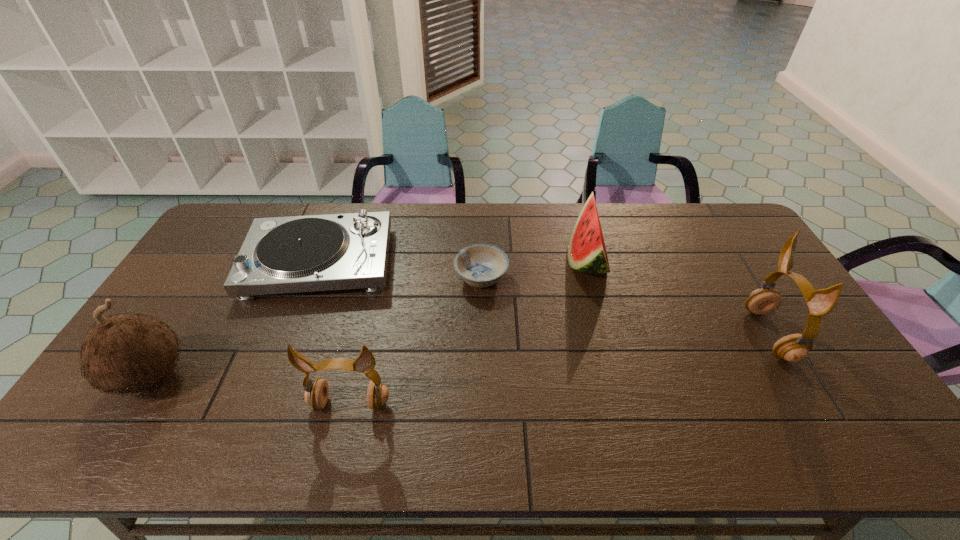
Where is `the left earphone`? Image resolution: width=960 pixels, height=540 pixels. the left earphone is located at coordinates (316, 393).

Locate an element on the screen. This screenshot has height=540, width=960. the nearer earphone is located at coordinates (316, 393).

This screenshot has height=540, width=960. I want to click on the right earphone, so [x=794, y=348].

The width and height of the screenshot is (960, 540). Find the location of `the taller earphone`. the taller earphone is located at coordinates (794, 348).

This screenshot has height=540, width=960. What are the coordinates of `watermelon` in the screenshot? It's located at (587, 253).

Where is `the fifth object from left to right`? the fifth object from left to right is located at coordinates (587, 253).

Find the location of a particular element. This screenshot has height=540, width=960. record player is located at coordinates (293, 254).

Where is `the third object from right to left`? the third object from right to left is located at coordinates (x=480, y=265).

Identify the location of bowl. (480, 265).

The image size is (960, 540). Identify the location of coconut. (128, 352).